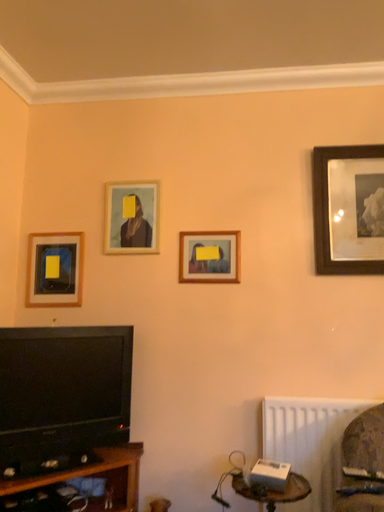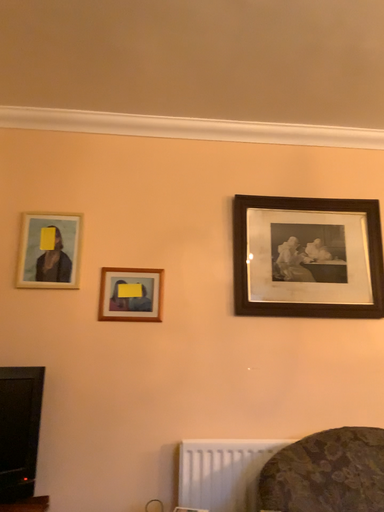
Question: How did the camera likely rotate when shooting the video?

Choices:
 (A) rotated right
 (B) rotated left

Answer: (A)